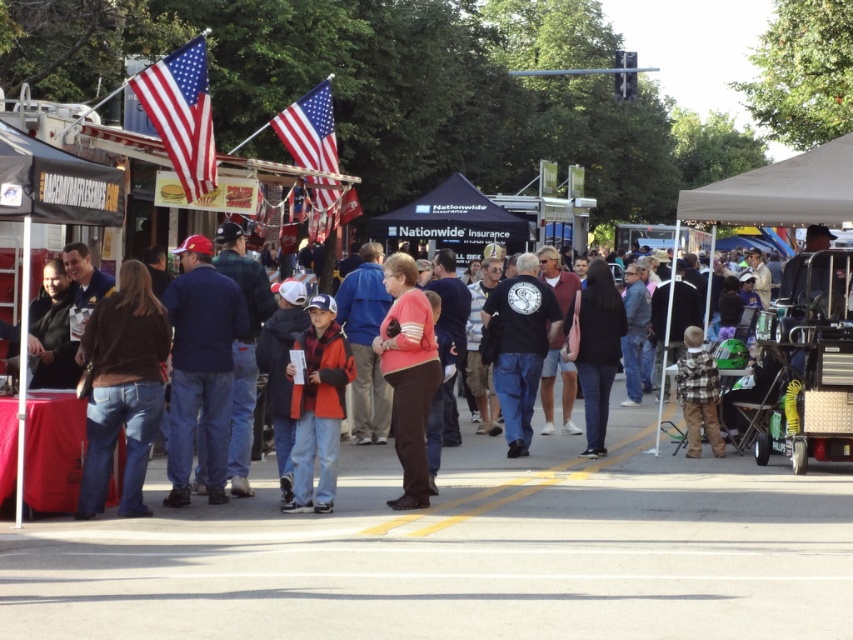
Question: Can you confirm if orange fleece jacket at center is positioned to the left of black matte jacket at center?

Choices:
 (A) no
 (B) yes

Answer: (B)

Question: Can you confirm if black fabric canopy at center is wider than polished metallic flag at upper center?

Choices:
 (A) no
 (B) yes

Answer: (B)

Question: Estimate the real-world distances between objects in this image. Which object is closer to the plaid flannel shirt at lower right?

Choices:
 (A) red/white/blue fabric flag at upper left
 (B) black cotton t-shirt at center

Answer: (B)

Question: Considering the real-world distances, which object is farthest from the plaid flannel shirt at lower right?

Choices:
 (A) brown leather jacket at left
 (B) black fabric canopy at center
 (C) black matte jacket at center
 (D) orange fleece jacket at center

Answer: (B)

Question: Which point appears farthest from the camera in this image?

Choices:
 (A) (460, 244)
 (B) (131, 445)

Answer: (A)

Question: Observing the image, what is the correct spatial positioning of brown leather jacket at left in reference to orange fleece jacket at center?

Choices:
 (A) above
 (B) below

Answer: (A)